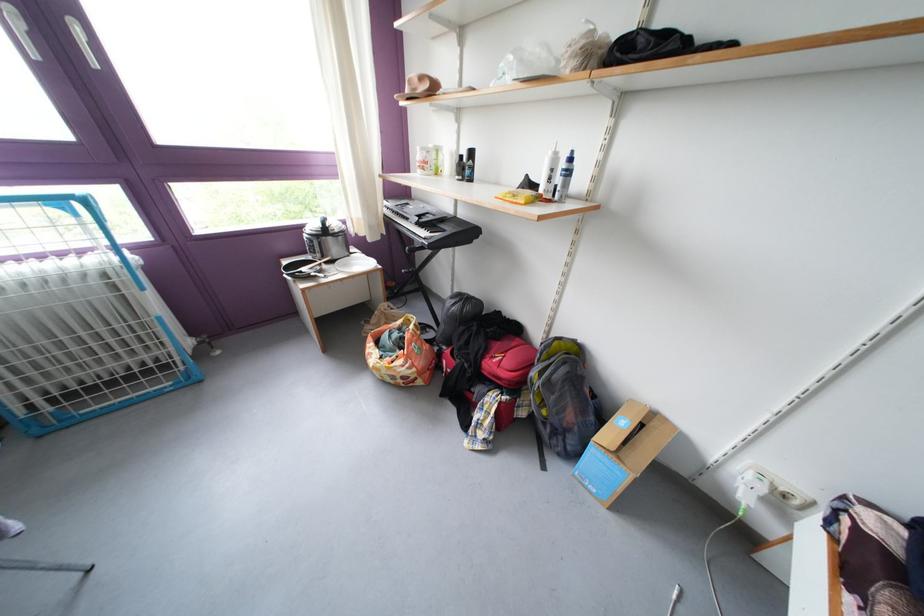
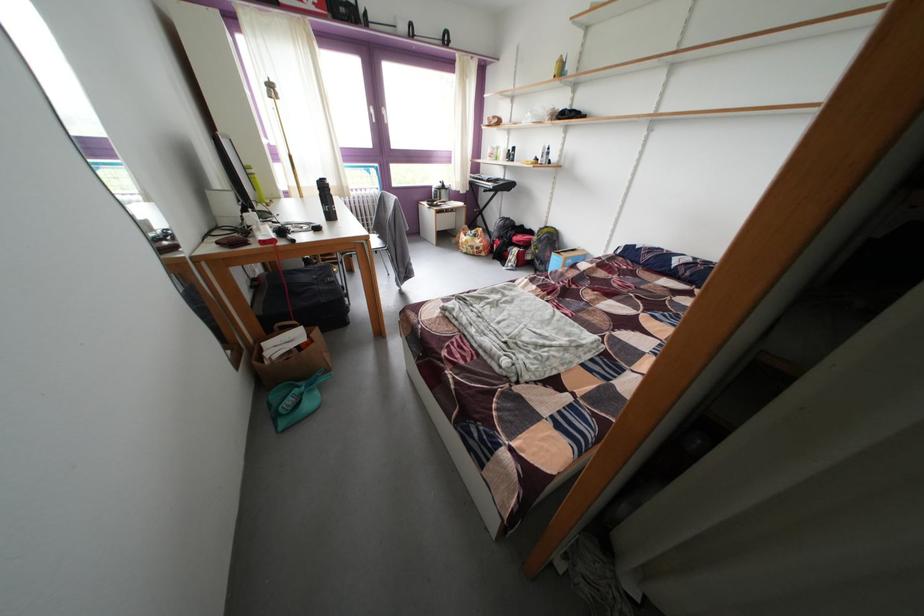
Find the pixel in the second image that matches (555,438) in the first image.

(548, 269)